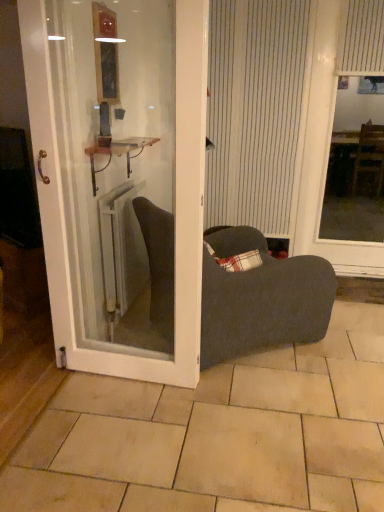
Where is `empty space that is to the right of white glossy door at center`? The width and height of the screenshot is (384, 512). empty space that is to the right of white glossy door at center is located at coordinates (234, 399).